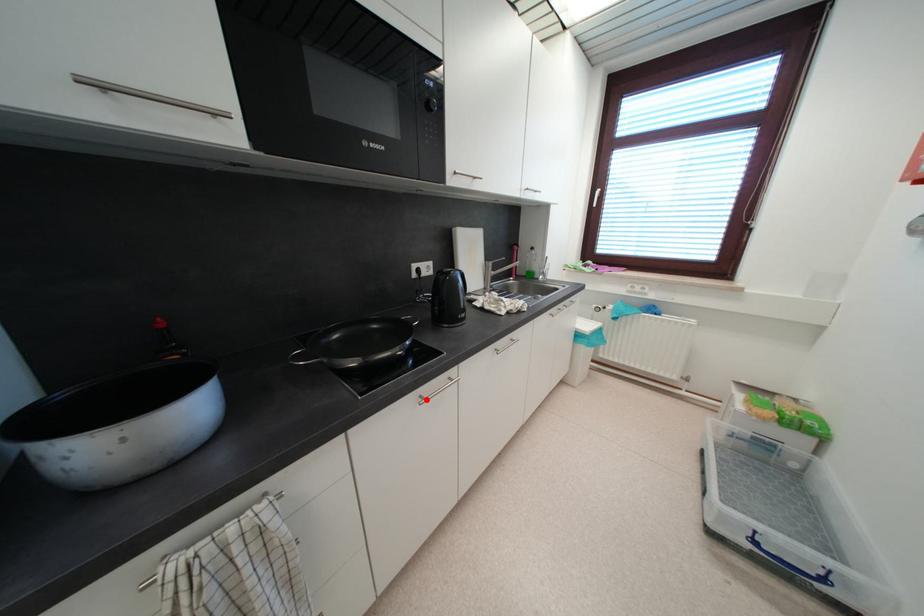
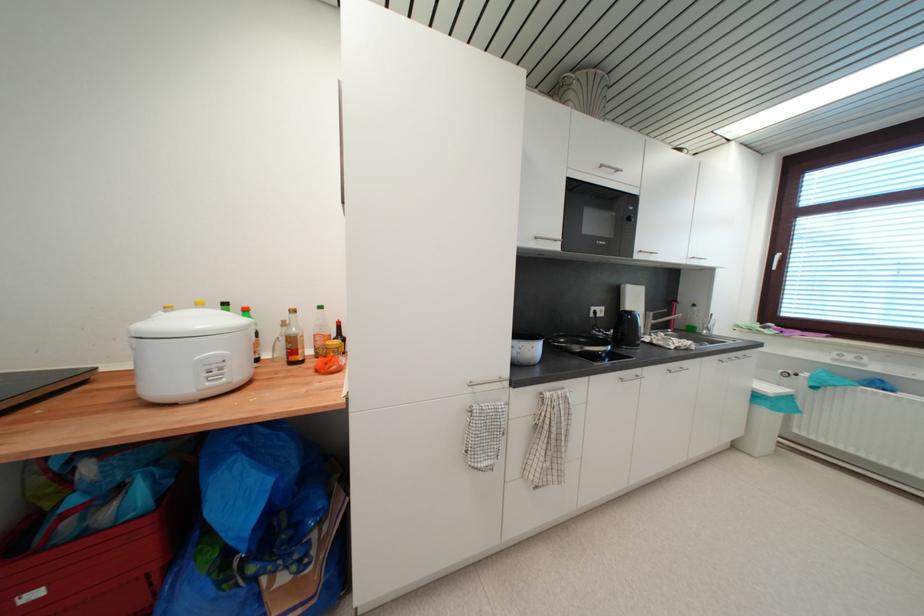
Find the pixel in the second image that matches the highlighted location in the first image.

(626, 381)